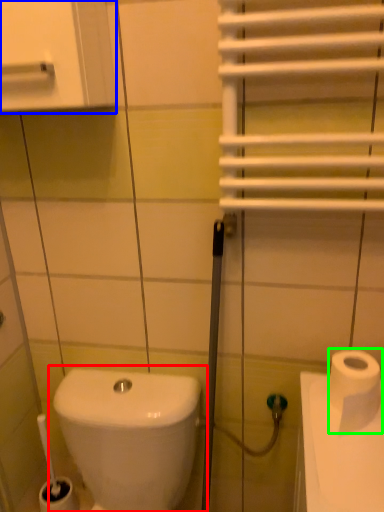
Question: Which object is positioned farthest from toilet (highlighted by a red box)? Select from medicine cabinet (highlighted by a blue box) and toilet paper (highlighted by a green box).

Choices:
 (A) medicine cabinet
 (B) toilet paper

Answer: (A)